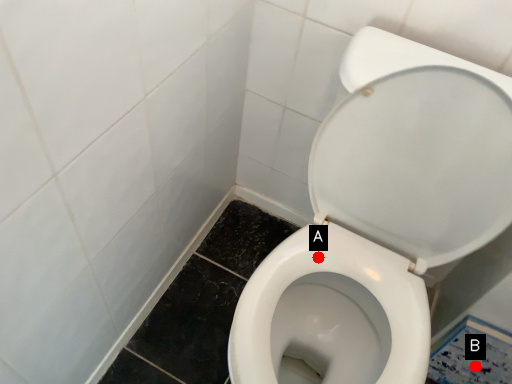
Question: Two points are circled on the image, labeled by A and B beside each circle. Which point is closer to the camera?

Choices:
 (A) A is closer
 (B) B is closer

Answer: (A)